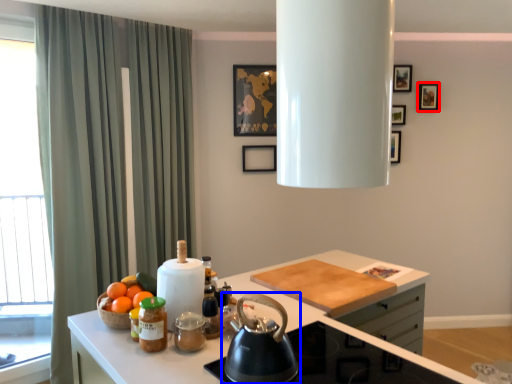
Question: Which object appears closest to the camera in this image, picture frame (highlighted by a red box) or kettle (highlighted by a blue box)?

Choices:
 (A) picture frame
 (B) kettle

Answer: (B)